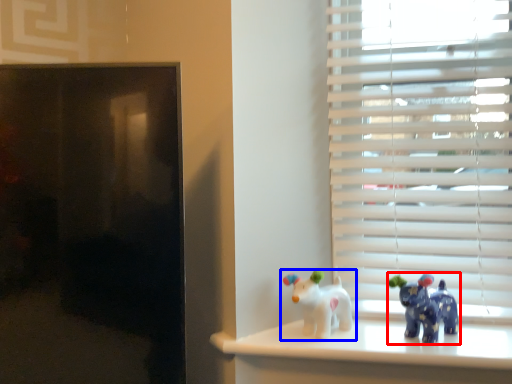
Question: Which of the following is the closest to the observer, toy (highlighted by a red box) or toy (highlighted by a blue box)?

Choices:
 (A) toy
 (B) toy

Answer: (A)